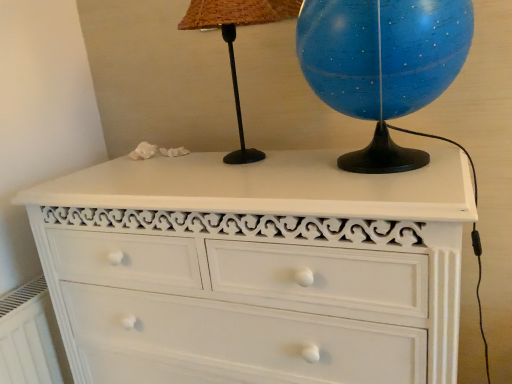
Where is `free area below black matte table lamp at upper center (from a real-world perspective)`? free area below black matte table lamp at upper center (from a real-world perspective) is located at coordinates (243, 153).